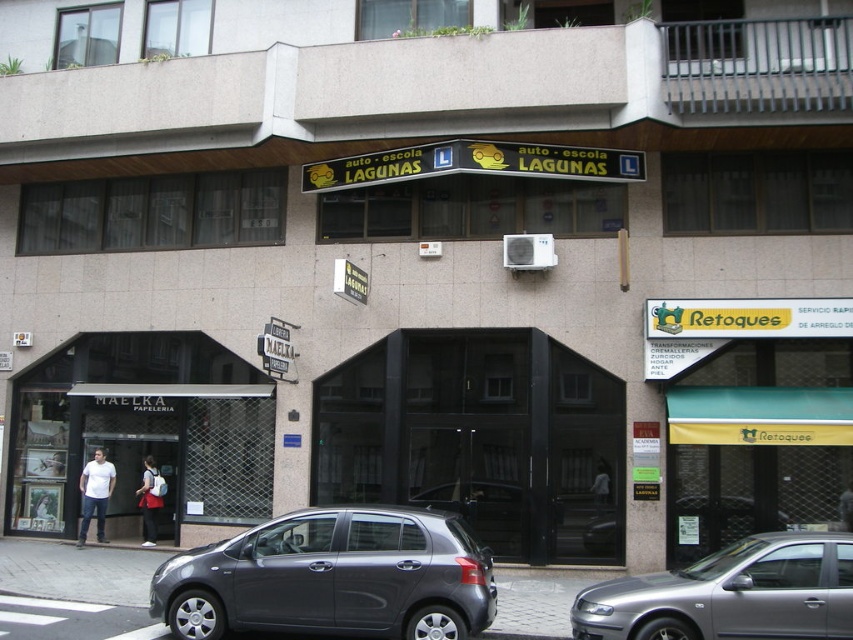
Question: Does silver metallic car at center lie behind white fabric bag at center?

Choices:
 (A) yes
 (B) no

Answer: (B)

Question: Which object is farther from the camera taking this photo?

Choices:
 (A) black glass door at center
 (B) white backpack at center
 (C) satin metallic hatchback at center

Answer: (B)

Question: Is the position of black glass door at center more distant than that of satin metallic hatchback at center?

Choices:
 (A) yes
 (B) no

Answer: (A)

Question: Among these points, which one is nearest to the camera?

Choices:
 (A) (144, 483)
 (B) (618, 524)
 (C) (608, 488)
 (D) (106, 484)

Answer: (B)

Question: Where is satin metallic hatchback at center located in relation to white fabric bag at center in the image?

Choices:
 (A) right
 (B) left

Answer: (B)

Question: Which of these objects is positioned farthest from the satin metallic hatchback at center?

Choices:
 (A) silver metallic car at center
 (B) black glass door at center
 (C) white backpack at center

Answer: (C)